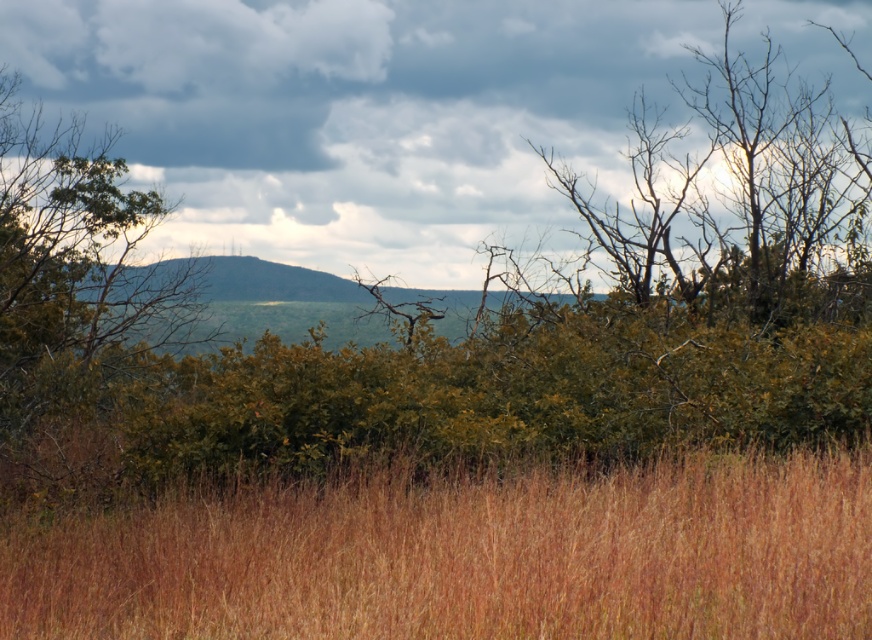
Is cloudy sky at upper center positioned before green leafy tree at left?

No, cloudy sky at upper center is further to the viewer.

Is cloudy sky at upper center taller than green leafy tree at left?

Yes, cloudy sky at upper center is taller than green leafy tree at left.

Does point (171, 168) come farther from viewer compared to point (125, 292)?

Yes, it is behind point (125, 292).

Where is `cloudy sky at upper center`? cloudy sky at upper center is located at coordinates (360, 115).

From the picture: Is brown dry grass at lower center thinner than green leafy tree at left?

No.

Between point (509, 554) and point (7, 218), which one is positioned in front?

Point (509, 554) is in front.

Locate an element on the screen. This screenshot has width=872, height=640. brown dry grass at lower center is located at coordinates (467, 556).

Is cloudy sky at upper center to the left of brown dry grass at lower center from the viewer's perspective?

No, cloudy sky at upper center is not to the left of brown dry grass at lower center.

Does cloudy sky at upper center appear over brown dry grass at lower center?

Yes, cloudy sky at upper center is above brown dry grass at lower center.

Which is in front, point (187, 106) or point (654, 500)?

Point (654, 500) is in front.

Locate an element on the screen. This screenshot has height=640, width=872. cloudy sky at upper center is located at coordinates (360, 115).